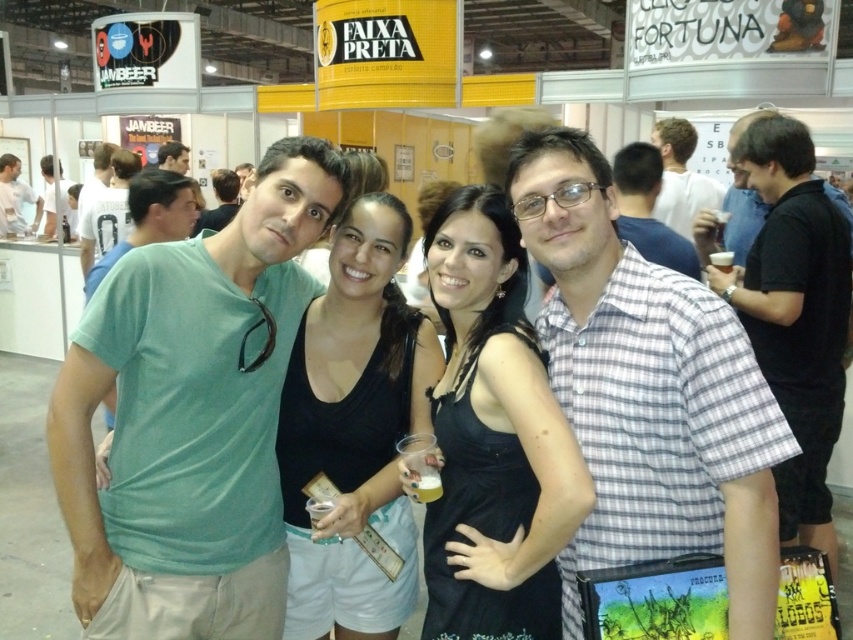
Consider the image. Based on the scene description, where is the checkered fabric shirt at center located in terms of coordinates?

The checkered fabric shirt at center is located at coordinates point (648, 392).